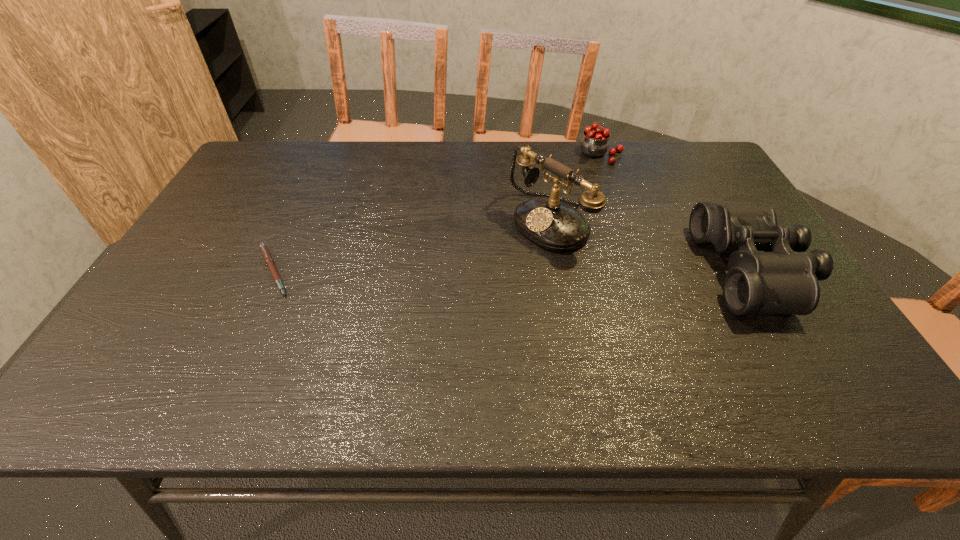
Identify the location of vacant space situated 0.280m at the eyepieces of the binoculars. (594, 270).

This screenshot has height=540, width=960. In order to click on free space located 0.390m on the handle side of the pot filled with cherries in this screenshot , I will do `click(556, 237)`.

Find the location of a particular element. This screenshot has width=960, height=540. vacant area situated 0.320m on the handle side of the pot filled with cherries is located at coordinates (564, 221).

Identify the location of free space located 0.250m on the handle side of the pot filled with cherries. The image size is (960, 540). (570, 207).

Where is `free space located 0.100m on the dial of the telephone`? free space located 0.100m on the dial of the telephone is located at coordinates (493, 262).

Locate an element on the screen. The height and width of the screenshot is (540, 960). free space located on the dial of the telephone is located at coordinates click(485, 268).

Find the location of a particular element. This screenshot has height=540, width=960. vacant space positioned on the dial of the telephone is located at coordinates (460, 284).

This screenshot has height=540, width=960. In order to click on object at the far edge in this screenshot , I will do `click(594, 143)`.

The image size is (960, 540). I want to click on object located in the right edge section of the desktop, so click(x=783, y=279).

The image size is (960, 540). In the image, there is a desktop. Identify the location of free space at the far edge. (655, 171).